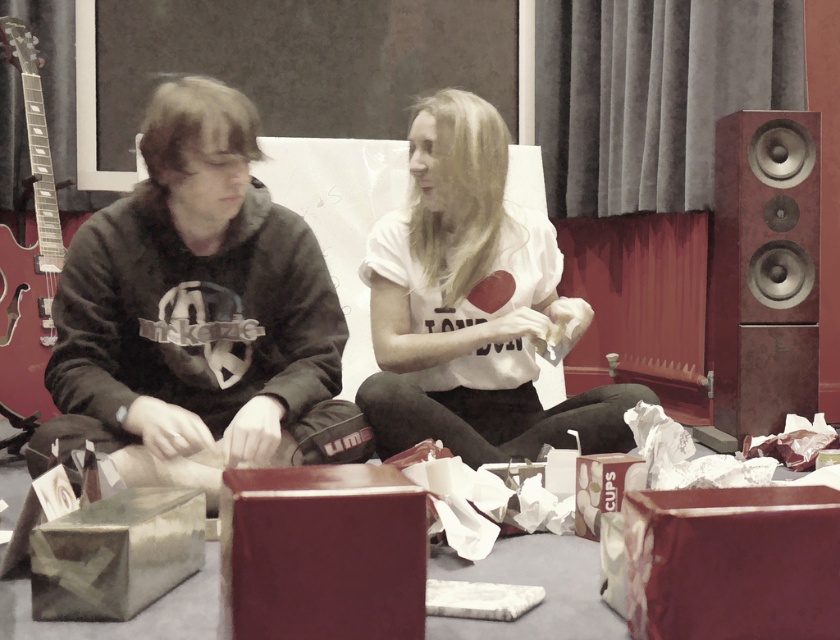
Who is lower down, dark gray hoodie at left or wooden/maroon speaker at right?

dark gray hoodie at left is below.

Is dark gray hoodie at left thinner than wooden/maroon speaker at right?

No.

Between point (177, 264) and point (726, 148), which one is positioned behind?

The point (726, 148) is more distant.

In order to click on dark gray hoodie at left in this screenshot , I will do `click(198, 310)`.

Is the position of shiny maroon box at lower right less distant than that of metallic silver box at lower left?

That is True.

Does shiny maroon box at lower right have a greater height compared to metallic silver box at lower left?

Indeed, shiny maroon box at lower right has a greater height compared to metallic silver box at lower left.

Is point (730, 493) positioned after point (109, 609)?

No, it is in front of (109, 609).

Where is `shiny maroon box at lower right`? This screenshot has width=840, height=640. shiny maroon box at lower right is located at coordinates (732, 563).

Is white matte t-shirt at center bigger than metallic silver box at lower left?

Indeed, white matte t-shirt at center has a larger size compared to metallic silver box at lower left.

Does point (496, 420) come closer to viewer compared to point (123, 609)?

No, it is not.

Where is `white matte t-shirt at center`? The height and width of the screenshot is (640, 840). white matte t-shirt at center is located at coordinates (471, 305).